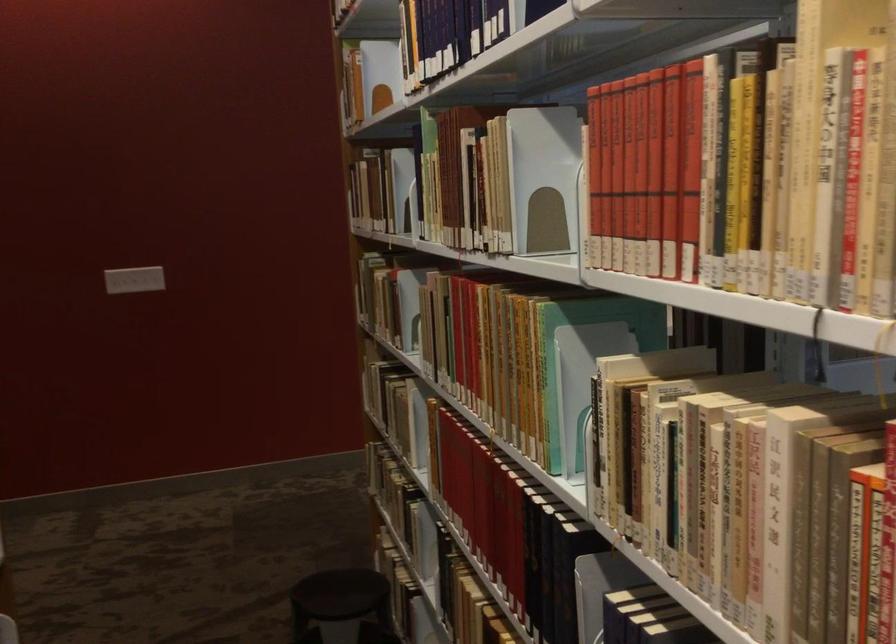
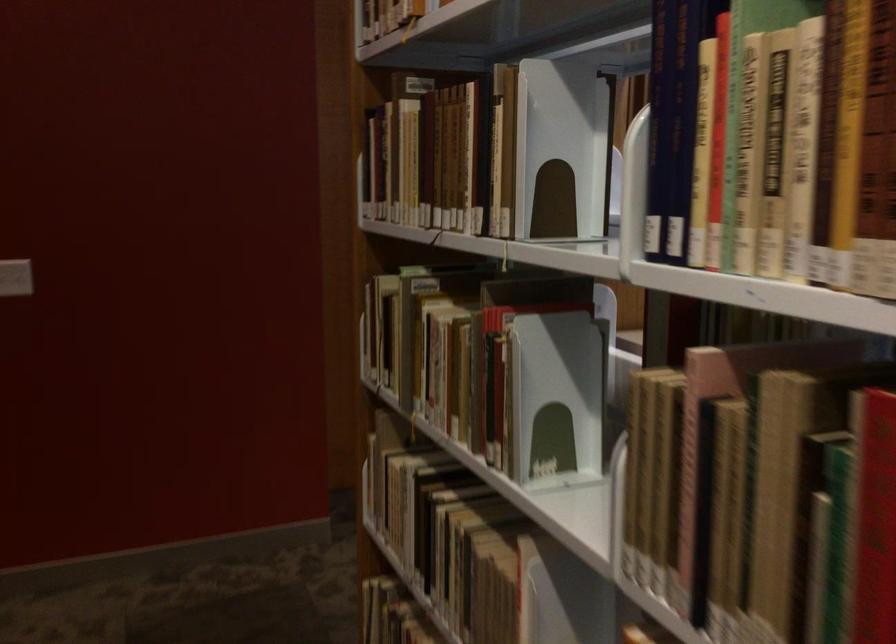
In the second image, find the point that corresponds to point 385,392 in the first image.

(445, 532)